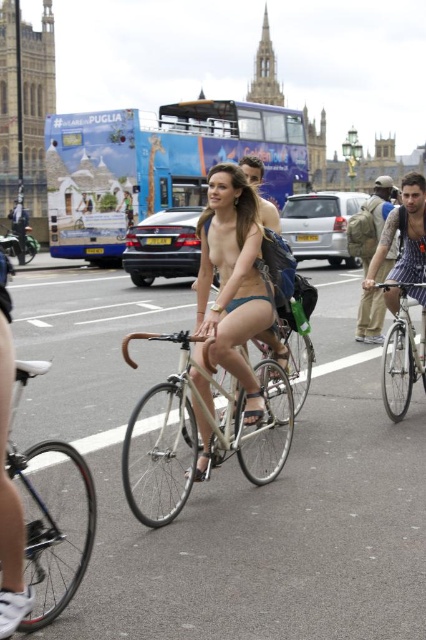
Question: Which point appears closest to the camera in this image?

Choices:
 (A) (25, 228)
 (B) (420, 355)

Answer: (B)

Question: Is blue painted double-decker bus at center below matte skin nude at center?

Choices:
 (A) yes
 (B) no

Answer: (B)

Question: Does matte skin nude at center appear on the right side of shiny silver bicycle at lower left?

Choices:
 (A) yes
 (B) no

Answer: (A)

Question: Which point is closer to the camera?

Choices:
 (A) (399, 451)
 (B) (244, 280)
 (C) (201, 118)
 (D) (417, 376)

Answer: (A)

Question: Which point is farther from the camera taking this photo?

Choices:
 (A) (23, 468)
 (B) (400, 372)
 (C) (141, 397)

Answer: (B)

Question: Is metallic silver bicycle at center to the left of silver metallic bicycle at center from the viewer's perspective?

Choices:
 (A) yes
 (B) no

Answer: (B)